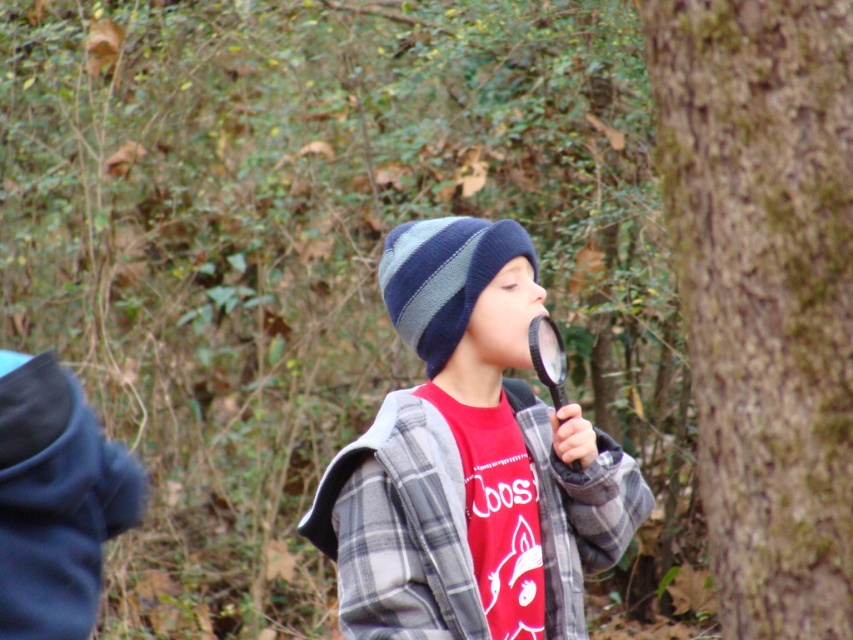
Question: Which object appears closest to the camera in this image?

Choices:
 (A) striped knit beanie at center
 (B) knit wool beanie at center

Answer: (B)

Question: Considering the real-world distances, which object is farthest from the knit wool beanie at center?

Choices:
 (A) black plastic magnifying glass at center
 (B) striped knit beanie at center

Answer: (B)

Question: Estimate the real-world distances between objects in this image. Which object is closer to the striped knit beanie at center?

Choices:
 (A) brown rough bark at right
 (B) black plastic magnifying glass at center
 (C) knit wool beanie at center

Answer: (B)

Question: Does knit wool beanie at center have a lesser width compared to striped knit beanie at center?

Choices:
 (A) no
 (B) yes

Answer: (A)

Question: Does knit wool beanie at center have a larger size compared to black plastic magnifying glass at center?

Choices:
 (A) yes
 (B) no

Answer: (A)

Question: Is knit wool beanie at center below striped knit beanie at center?

Choices:
 (A) no
 (B) yes

Answer: (B)